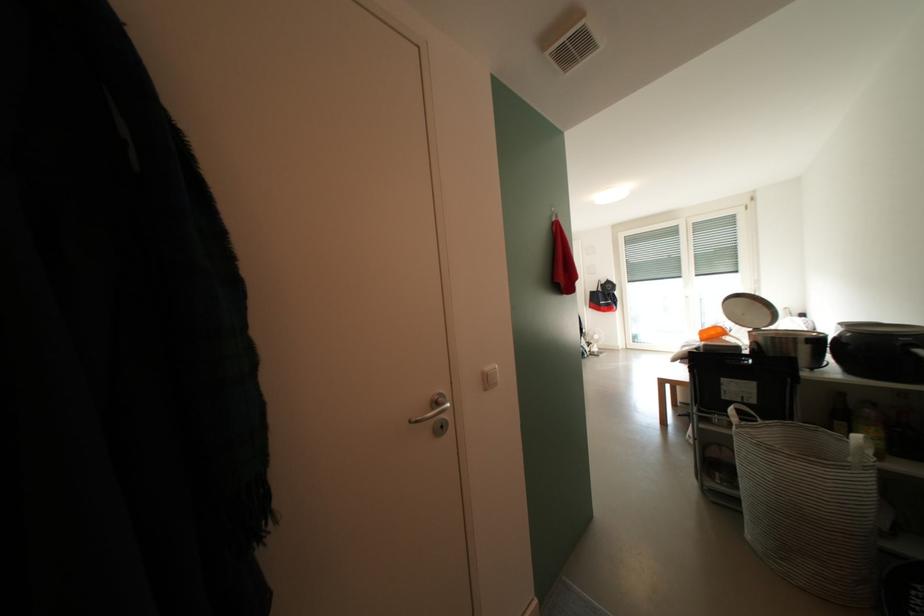
Find where to lift the striped basket handle. Please return your answer as a coordinate pair (x, y).

(857, 438)